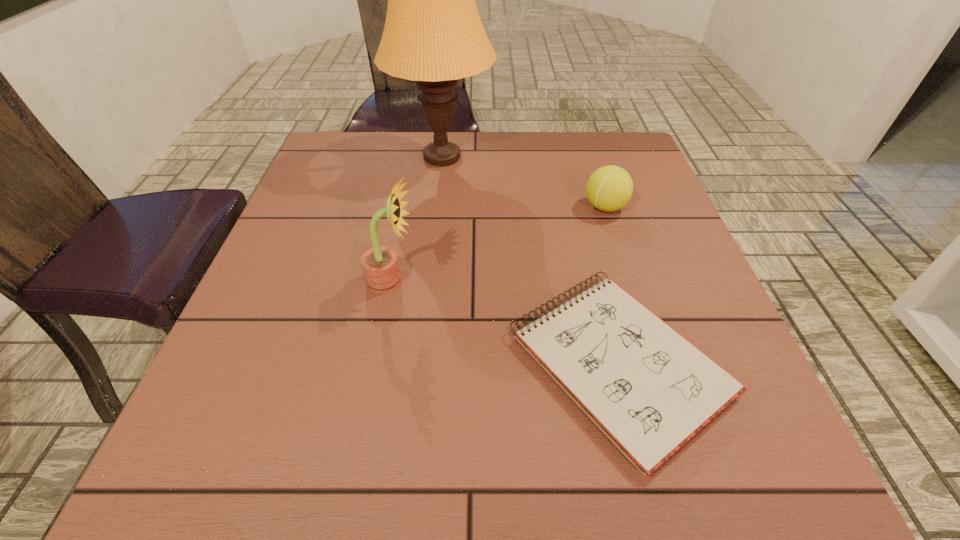
Find the location of a particular element. The image size is (960, 540). vacant space that is in between the notepad and the farthest object is located at coordinates (531, 260).

The image size is (960, 540). In order to click on free space between the tallest object and the shortest object in this screenshot , I will do `click(531, 260)`.

Locate an element on the screen. free space that is in between the tallest object and the notepad is located at coordinates (531, 260).

Where is `vacant area that lies between the shortest object and the farthest object`? The image size is (960, 540). vacant area that lies between the shortest object and the farthest object is located at coordinates (531, 260).

The height and width of the screenshot is (540, 960). What are the coordinates of `vacant area that lies between the sunflower and the lampshade` in the screenshot? It's located at (417, 219).

At what (x,y) coordinates should I click in order to perform the action: click on empty space that is in between the sunflower and the shortest object. Please return your answer as a coordinate pair (x, y). Image resolution: width=960 pixels, height=540 pixels. Looking at the image, I should click on [x=505, y=322].

At what (x,y) coordinates should I click in order to perform the action: click on unoccupied position between the shortest object and the second tallest object. Please return your answer as a coordinate pair (x, y). Looking at the image, I should click on (505, 322).

You are a GUI agent. You are given a task and a screenshot of the screen. Output one action in this format:
    pyautogui.click(x=<x>, y=<y>)
    Task: Click on the free space between the second tallest object and the lampshade
    Image resolution: width=960 pixels, height=540 pixels.
    Given the screenshot: What is the action you would take?
    pyautogui.click(x=417, y=219)

Where is `vacant region between the lampshade and the sunflower`? Image resolution: width=960 pixels, height=540 pixels. vacant region between the lampshade and the sunflower is located at coordinates (417, 219).

Identify the location of vacant point located between the second tallest object and the tennis ball. (498, 244).